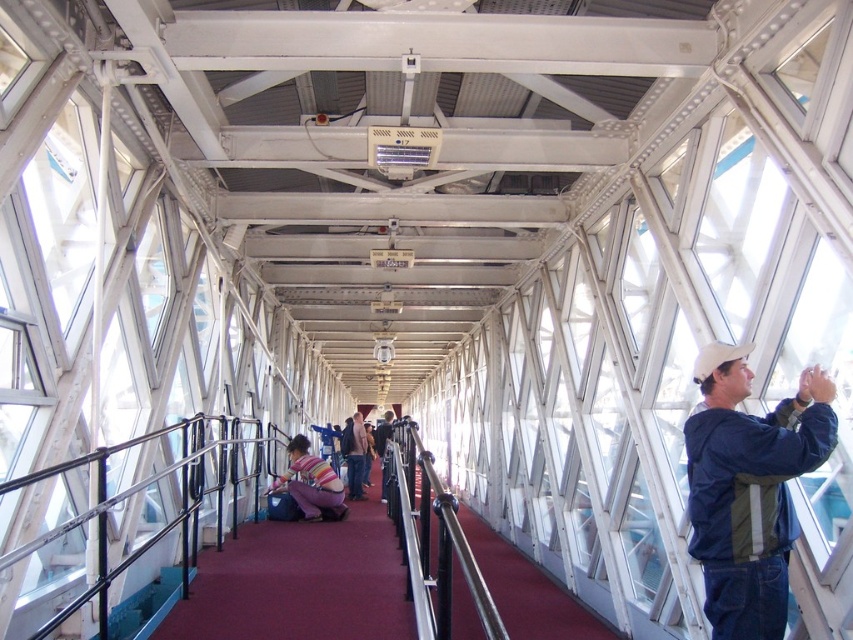
Does black metal/rail at center have a greater height compared to striped fabric shirt at center?

Incorrect, black metal/rail at center's height is not larger of striped fabric shirt at center's.

Who is more distant from viewer, [393,436] or [357,429]?

The point [357,429] is more distant.

Which is behind, point (486, 609) or point (357, 460)?

The point (357, 460) is more distant.

Find the location of a particular element. This screenshot has height=640, width=853. black metal/rail at center is located at coordinates (430, 540).

Is blue fabric jacket at right shorter than striped fabric shirt at center?

In fact, blue fabric jacket at right may be taller than striped fabric shirt at center.

Where is `blue fabric jacket at right`? The width and height of the screenshot is (853, 640). blue fabric jacket at right is located at coordinates (749, 488).

Locate an element on the screen. This screenshot has width=853, height=640. blue fabric jacket at right is located at coordinates pos(749,488).

Which is behind, point (291, 476) or point (357, 420)?

Point (357, 420)

Can you confirm if striped sweater at center is positioned to the left of striped fabric shirt at center?

Correct, you'll find striped sweater at center to the left of striped fabric shirt at center.

Find the location of a particular element. The height and width of the screenshot is (640, 853). striped sweater at center is located at coordinates (311, 483).